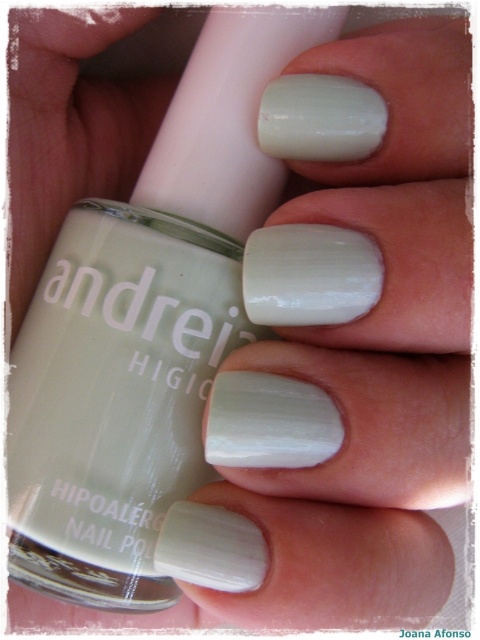
Does matte white nail polish at center appear over matte white nails at center?

Incorrect, matte white nail polish at center is not positioned above matte white nails at center.

This screenshot has height=640, width=480. What do you see at coordinates (144, 326) in the screenshot?
I see `matte white nail polish at center` at bounding box center [144, 326].

Find the location of `matte white nail polish at center`. matte white nail polish at center is located at coordinates (144, 326).